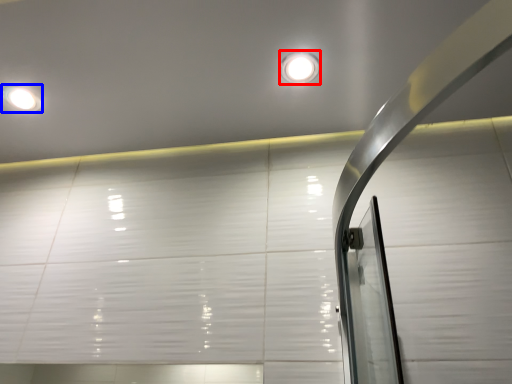
Question: Which object appears closest to the camera in this image, droplight (highlighted by a red box) or droplight (highlighted by a blue box)?

Choices:
 (A) droplight
 (B) droplight

Answer: (A)